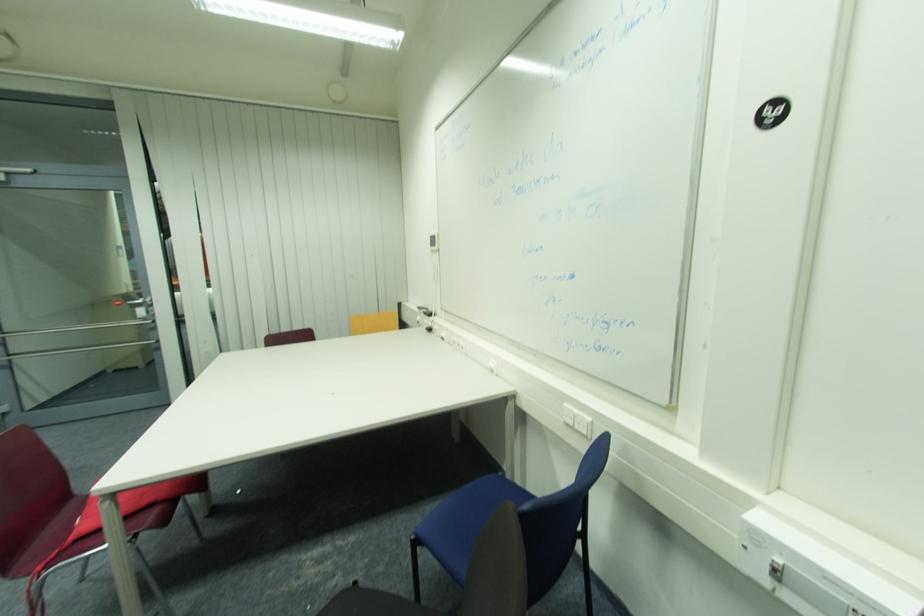
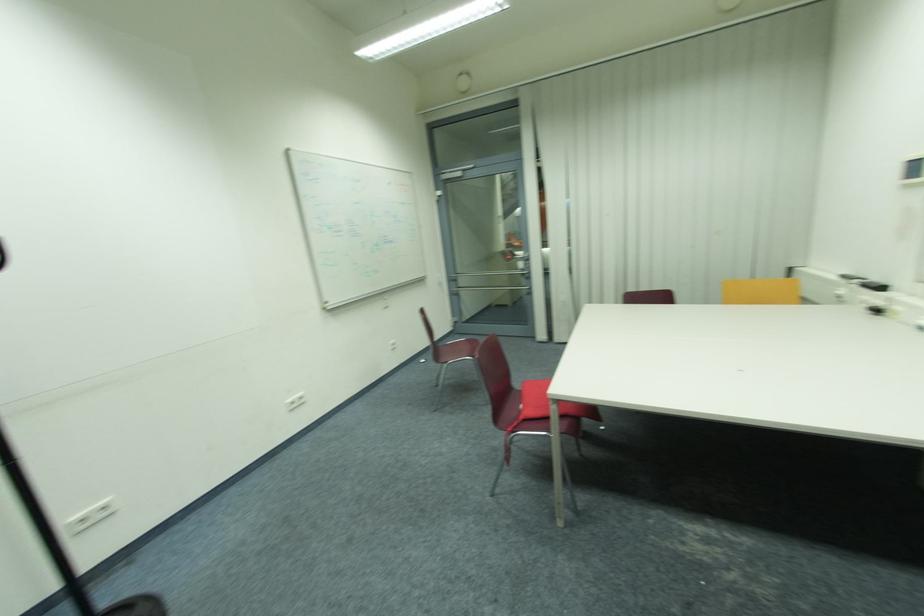
Locate, in the second image, the point that corresponds to pixel 73 540 in the first image.

(527, 418)